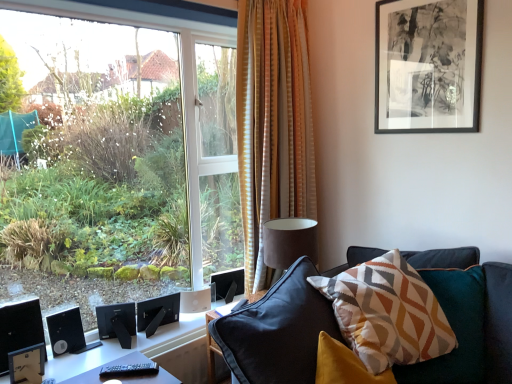
This screenshot has width=512, height=384. I want to click on empty space that is to the right of black matte speaker at lower left, which is the 1th speaker in left-to-right order, so click(86, 356).